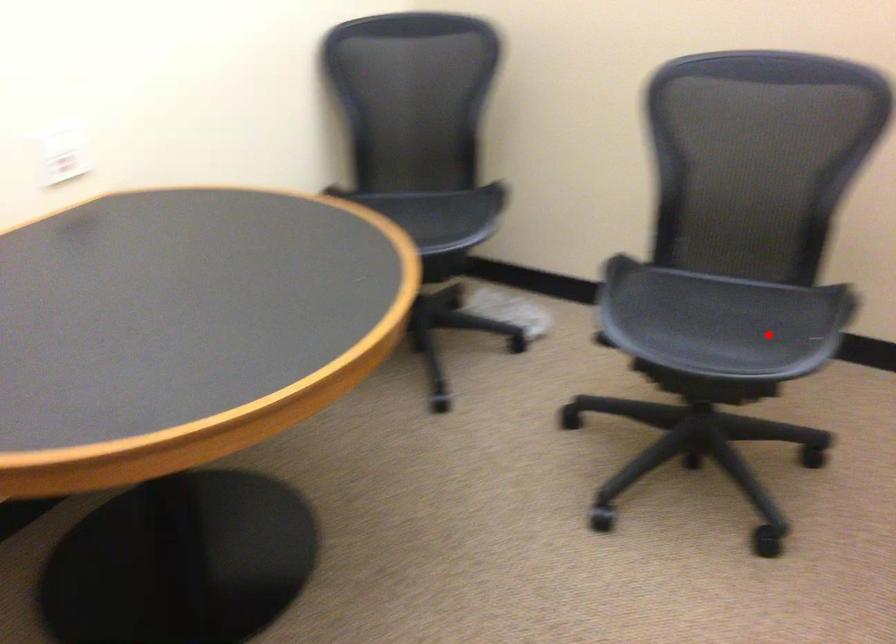
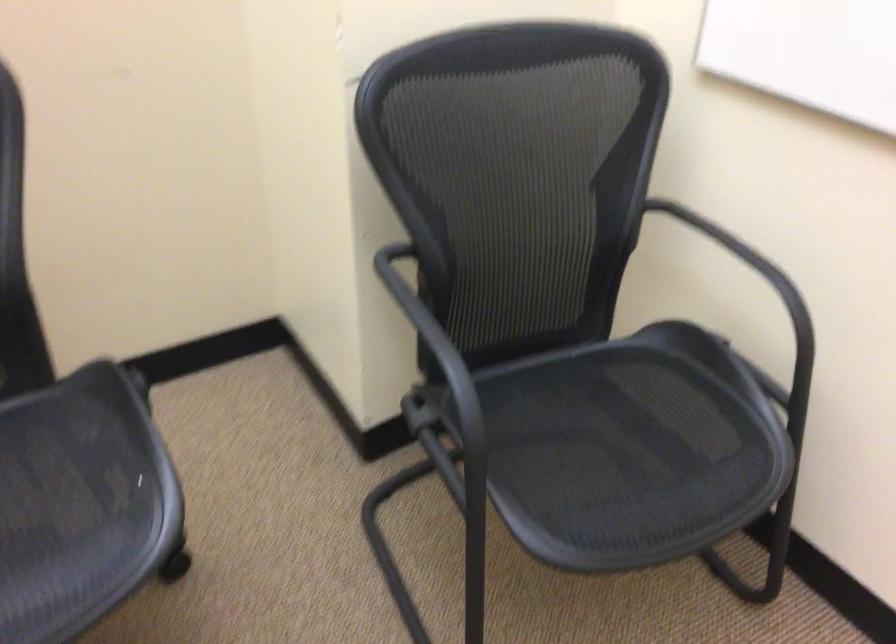
Where in the second image is the point corresponding to the highlighted location from the first image?

(80, 503)